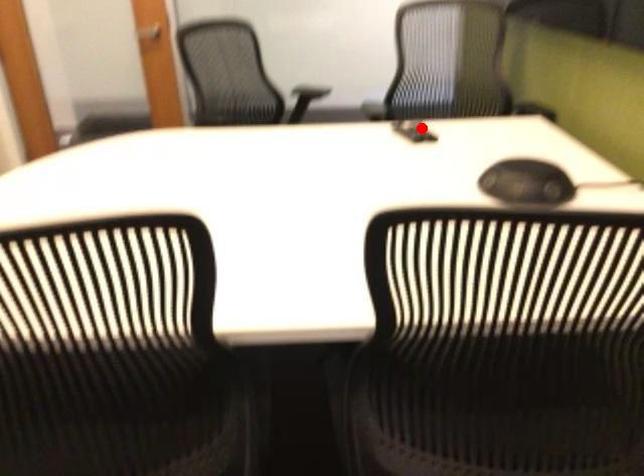
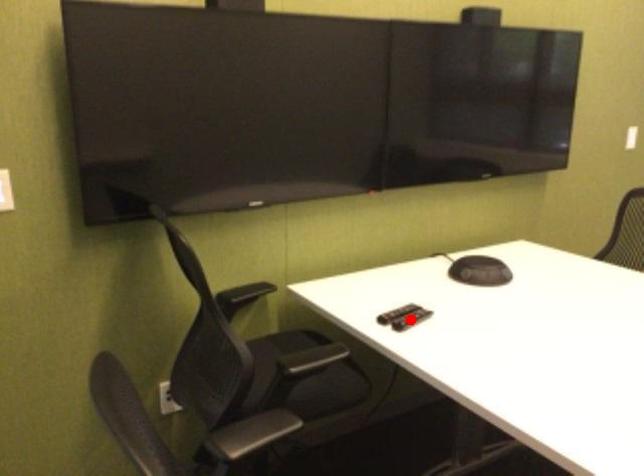
I am providing you with two images of the same scene from different viewpoints. A red point is marked on the first image and another point is marked on the second image. Is the red point in image1 aligned with the point shown in image2?

No